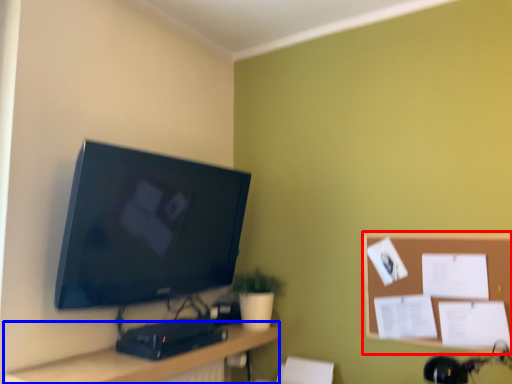
Question: Among these objects, which one is nearest to the camera, bulletin board (highlighted by a red box) or desk (highlighted by a blue box)?

Choices:
 (A) bulletin board
 (B) desk

Answer: (B)